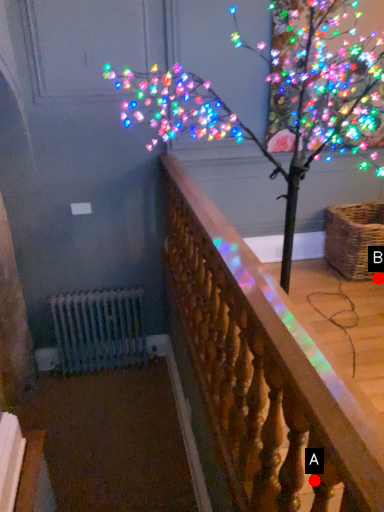
Question: Two points are circled on the image, labeled by A and B beside each circle. Among these points, which one is farthest from the camera?

Choices:
 (A) A is further
 (B) B is further

Answer: (B)